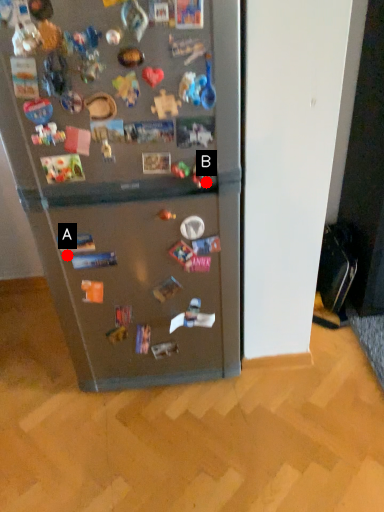
Question: Two points are circled on the image, labeled by A and B beside each circle. Which point is further to the camera?

Choices:
 (A) A is further
 (B) B is further

Answer: (A)